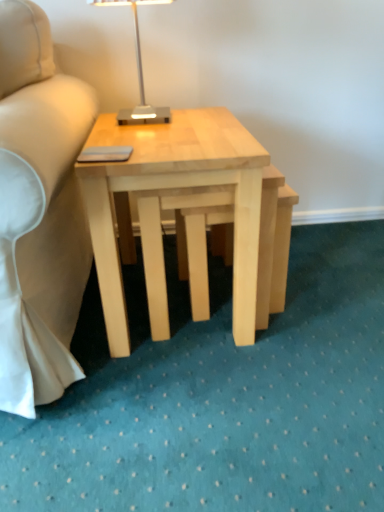
This screenshot has height=512, width=384. What are the coordinates of `vacant area to the right of natural wood step stool at center` in the screenshot? It's located at (334, 298).